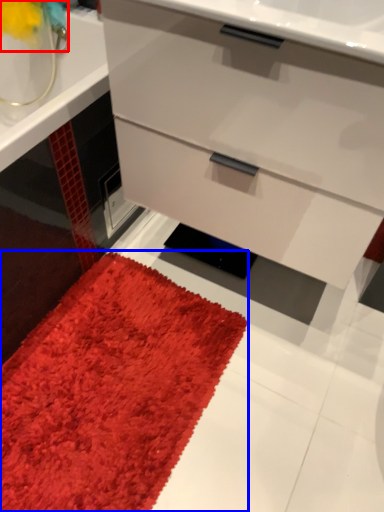
Question: Which point is closer to the camera, flower (highlighted by a red box) or mat (highlighted by a blue box)?

Choices:
 (A) flower
 (B) mat

Answer: (B)